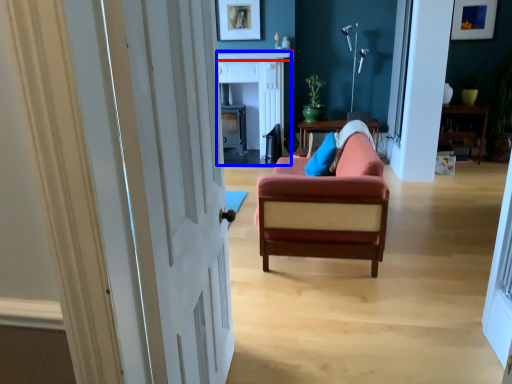
Question: Which of the following is the farthest to the observer, mantle (highlighted by a red box) or fireplace (highlighted by a blue box)?

Choices:
 (A) mantle
 (B) fireplace

Answer: (A)